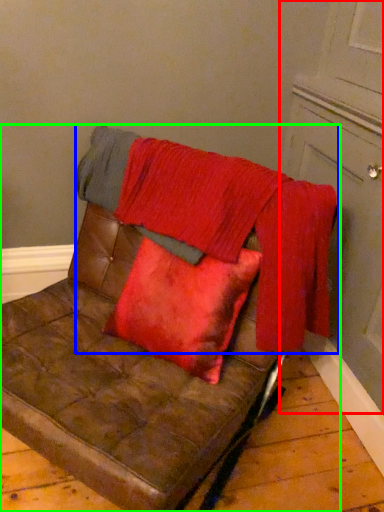
Question: Which object is positioned closest to door (highlighted by a red box)? Select from blanket (highlighted by a blue box) and furniture (highlighted by a green box).

Choices:
 (A) blanket
 (B) furniture

Answer: (A)